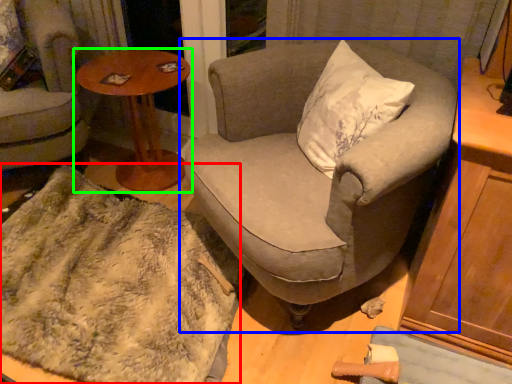
Question: Which object is positioned closest to blanket (highlighted by a red box)? Select from chair (highlighted by a blue box) and table (highlighted by a green box).

Choices:
 (A) chair
 (B) table

Answer: (A)